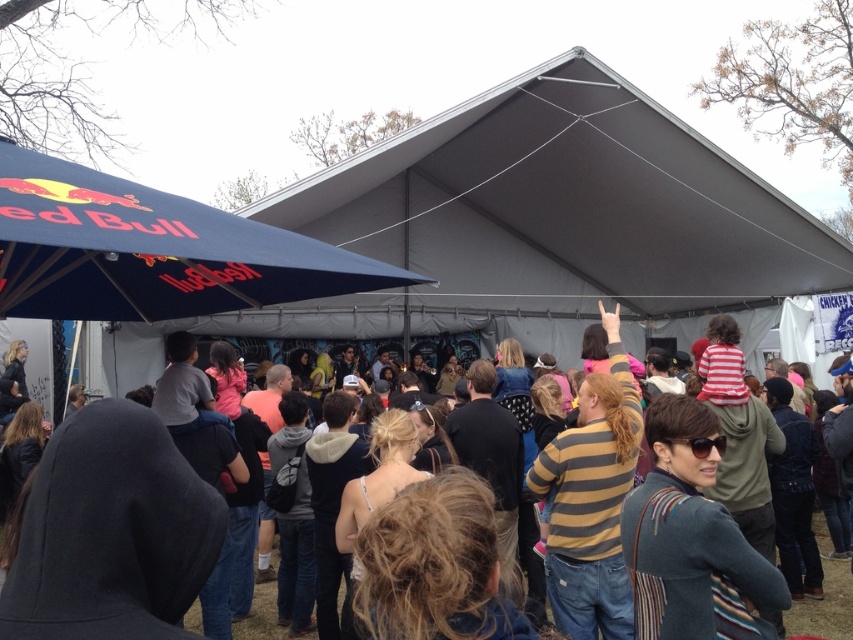
Is the position of navy blue fabric canopy at upper left more distant than that of striped sweater at center?

→ No, it is not.

Based on the photo, is navy blue fabric canopy at upper left shorter than striped sweater at center?

Yes.

Image resolution: width=853 pixels, height=640 pixels. Describe the element at coordinates (149, 250) in the screenshot. I see `navy blue fabric canopy at upper left` at that location.

Find the location of a particular element. navy blue fabric canopy at upper left is located at coordinates (149, 250).